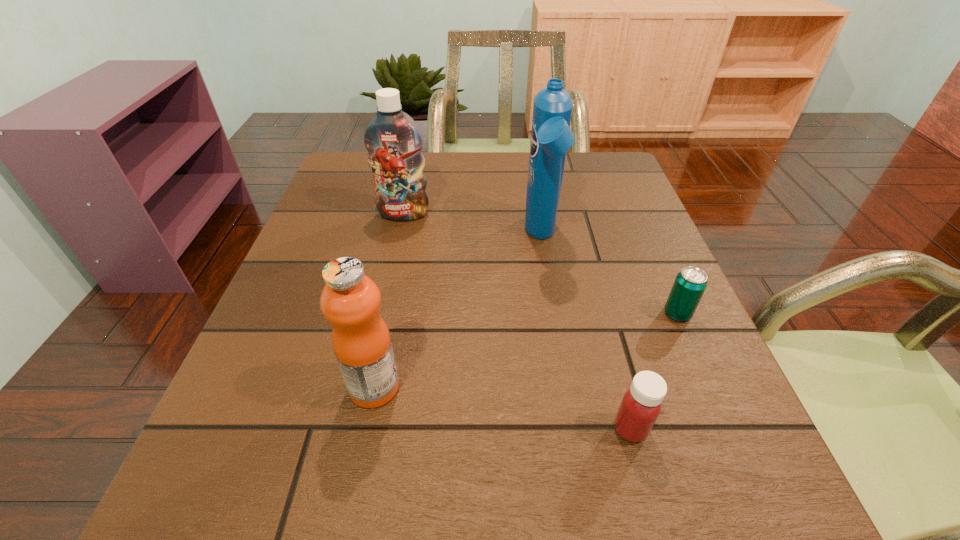
Locate an element on the screen. This screenshot has height=540, width=960. blank region between the left shampoo and the second nearest object is located at coordinates (389, 300).

Where is `object that is the fourth closest to the fourth tallest object`? Image resolution: width=960 pixels, height=540 pixels. object that is the fourth closest to the fourth tallest object is located at coordinates (394, 142).

Where is `object identified as the second closest to the left shampoo`? object identified as the second closest to the left shampoo is located at coordinates (350, 300).

Identify the location of blank space that satisfies the following two spatial constraints: 1. on the front side of the beer can; 2. on the right side of the third object from right to left. The height and width of the screenshot is (540, 960). (554, 314).

Find the location of a particular element. blank space that satisfies the following two spatial constraints: 1. on the front label of the left shampoo; 2. on the left side of the medicine is located at coordinates (356, 429).

Image resolution: width=960 pixels, height=540 pixels. Find the location of `vacant space that satisfies the following two spatial constraints: 1. on the front label of the second shortest object; 2. on the left side of the left shampoo`. vacant space that satisfies the following two spatial constraints: 1. on the front label of the second shortest object; 2. on the left side of the left shampoo is located at coordinates (356, 429).

Find the location of a particular element. Image resolution: width=960 pixels, height=540 pixels. vacant space that satisfies the following two spatial constraints: 1. on the front label of the fruit juice; 2. on the right side of the left shampoo is located at coordinates (366, 387).